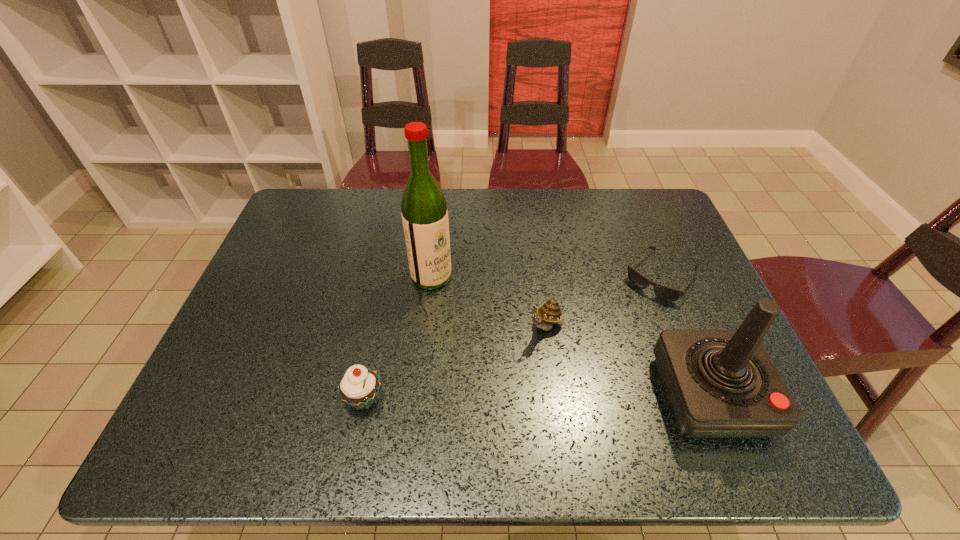
At what (x,y) coordinates should I click in order to perform the action: click on blank region between the leftmost object and the snail. Please return your answer as a coordinate pair (x, y). The image size is (960, 540). Looking at the image, I should click on (455, 364).

Locate an element on the screen. The height and width of the screenshot is (540, 960). free space between the liquor and the leftmost object is located at coordinates click(397, 338).

You are a GUI agent. You are given a task and a screenshot of the screen. Output one action in this format:
    pyautogui.click(x=<x>, y=<y>)
    Task: Click on the vacant area that lies between the joystick and the tallest object
    The image size is (960, 540).
    Given the screenshot: What is the action you would take?
    pyautogui.click(x=571, y=336)

Locate an element on the screen. This screenshot has width=960, height=540. vacant space in between the fourth object from right to left and the third object from right to left is located at coordinates (489, 302).

This screenshot has height=540, width=960. I want to click on free spot between the cupcake and the liquor, so coord(397,338).

In order to click on free space between the second object from left to right and the leftmost object in this screenshot , I will do `click(397, 338)`.

Find the location of `blank region between the leftmost object and the third object from left to right`. blank region between the leftmost object and the third object from left to right is located at coordinates (455, 364).

Locate an element on the screen. The image size is (960, 540). vacant area that lies between the shortest object and the cupcake is located at coordinates (513, 338).

Where is `vacant space that is in between the fourth shortest object and the tallest object`? Image resolution: width=960 pixels, height=540 pixels. vacant space that is in between the fourth shortest object and the tallest object is located at coordinates (571, 336).

Where is `object that stands as the third closest to the cupcake`? object that stands as the third closest to the cupcake is located at coordinates (719, 383).